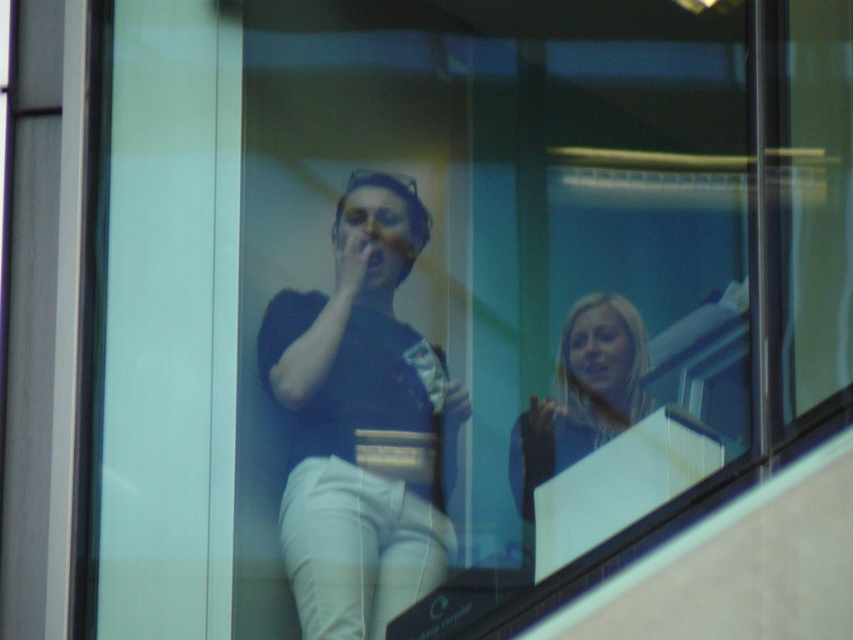
You are a security camera positioned at the center of the room. You need to determine if the two people in the scene are within the same room. The security camera has a maximum effective range of 10 feet. Based on the distance between the matte black shirt at center and the other person, can you confirm if both are in the same room?

The distance between the matte black shirt at center and the other person is 13.71 feet, which exceeds the security camera maximum effective range of 10 feet. Therefore, the two people are likely not in the same room.

Based on the scene description, where exactly is the matte black shirt at center located in the image?

The matte black shirt at center is located at point coordinates of (x=363, y=422).

You are an architect designing a new building with a reflective window. You want to ensure that the reflection of the matte black shirt at center and the blonde hair at center can be clearly distinguished in the window. Given that the two objects are 10.61 inches apart, what is the minimum distance the window should be from the subjects to achieve this clarity?

The minimum distance required for the window to clearly distinguish the matte black shirt at center and the blonde hair at center, which are 10.61 inches apart, depends on the resolution of the reflective surface and the viewing angle. However, using the Rayleigh criterion for resolution, the distance can be calculated using the formula d_min > 1.2204084266433767561612725855096664047228094569561340820312500000000000000000000000000000000000000000000000000000000000000000000000000000000000000000000000000000000